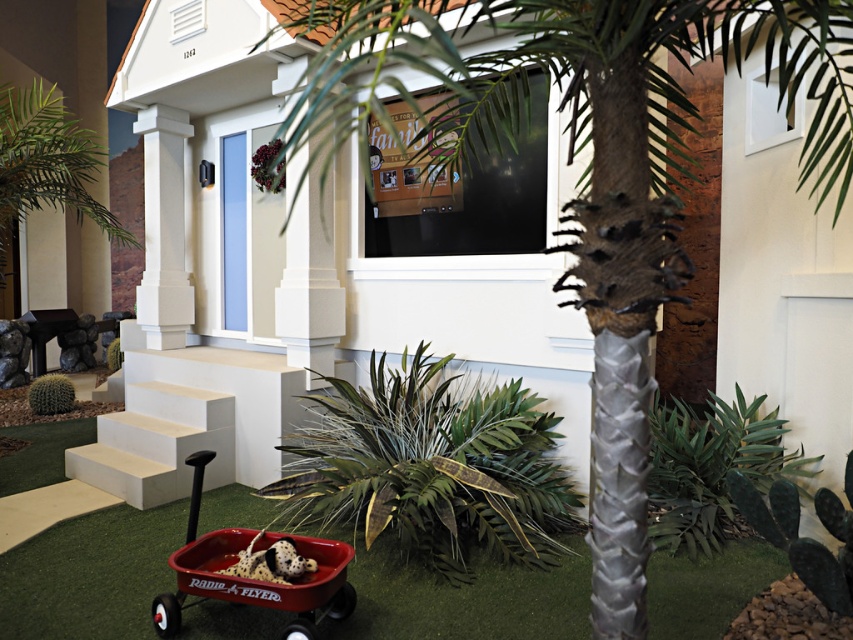
Based on the photo, does silver textured palm tree at center appear under green artificial turf at lower center?

Incorrect, silver textured palm tree at center is not positioned below green artificial turf at lower center.

Between silver textured palm tree at center and green artificial turf at lower center, which one has more height?

silver textured palm tree at center

Which is behind, point (624, 637) or point (213, 627)?

The point (213, 627) is more distant.

The height and width of the screenshot is (640, 853). Find the location of `silver textured palm tree at center`. silver textured palm tree at center is located at coordinates (587, 172).

Is green artificial turf at lower center wider than white smooth stairs at lower left?

In fact, green artificial turf at lower center might be narrower than white smooth stairs at lower left.

Who is shorter, green artificial turf at lower center or white smooth stairs at lower left?

Standing shorter between the two is green artificial turf at lower center.

Does point (474, 580) come closer to viewer compared to point (106, 461)?

Yes.

You are a GUI agent. You are given a task and a screenshot of the screen. Output one action in this format:
    pyautogui.click(x=<x>, y=<y>)
    Task: Click on the green artificial turf at lower center
    
    Given the screenshot: What is the action you would take?
    pyautogui.click(x=90, y=573)

Is silver textured palm tree at center smaller than white smooth stairs at lower left?

No, silver textured palm tree at center is not smaller than white smooth stairs at lower left.

Does silver textured palm tree at center have a lesser height compared to white smooth stairs at lower left?

No, silver textured palm tree at center is not shorter than white smooth stairs at lower left.

You are a GUI agent. You are given a task and a screenshot of the screen. Output one action in this format:
    pyautogui.click(x=<x>, y=<y>)
    Task: Click on the silver textured palm tree at center
    This screenshot has width=853, height=640.
    Given the screenshot: What is the action you would take?
    pyautogui.click(x=587, y=172)